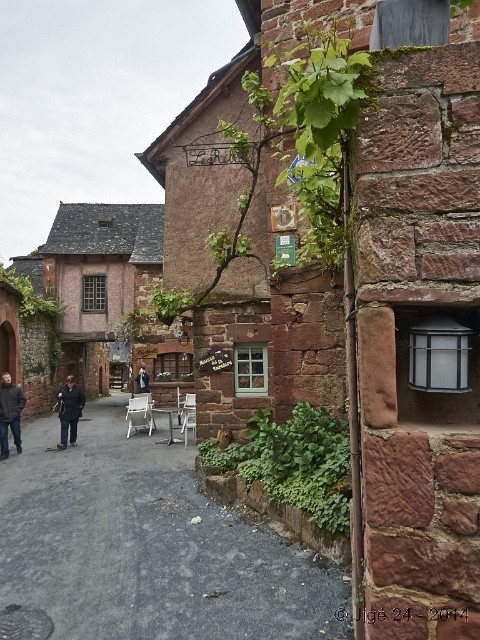
Based on the photo, can you confirm if smooth stone alley at center is shorter than dark blue fabric jacket at center?

Yes, smooth stone alley at center is shorter than dark blue fabric jacket at center.

The height and width of the screenshot is (640, 480). Describe the element at coordinates (148, 545) in the screenshot. I see `smooth stone alley at center` at that location.

Identify the location of smooth stone alley at center. (148, 545).

Is smooth stone alley at center closer to the viewer compared to dark gray fabric jacket at center?

Yes, smooth stone alley at center is in front of dark gray fabric jacket at center.

You are a GUI agent. You are given a task and a screenshot of the screen. Output one action in this format:
    pyautogui.click(x=<x>, y=<y>)
    Task: Click on the smooth stone alley at center
    This screenshot has height=640, width=480.
    Given the screenshot: What is the action you would take?
    pyautogui.click(x=148, y=545)

Which is behind, point (179, 496) or point (137, 380)?

The point (137, 380) is behind.

Locate an element on the screen. The height and width of the screenshot is (640, 480). smooth stone alley at center is located at coordinates (148, 545).

Is smooth stone alley at center taller than dark gray jacket at lower left?

Incorrect, smooth stone alley at center's height is not larger of dark gray jacket at lower left's.

Is smooth stone alley at center to the left of dark gray jacket at lower left from the viewer's perspective?

In fact, smooth stone alley at center is to the right of dark gray jacket at lower left.

Where is `smooth stone alley at center`? This screenshot has width=480, height=640. smooth stone alley at center is located at coordinates (148, 545).

Locate an element on the screen. The image size is (480, 640). smooth stone alley at center is located at coordinates (148, 545).